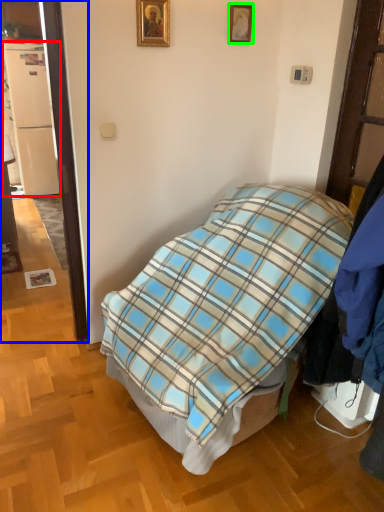
Question: Which object is the closest to the refrigerator (highlighted by a red box)? Choose among these: door (highlighted by a blue box) or picture frame (highlighted by a green box).

Choices:
 (A) door
 (B) picture frame

Answer: (A)